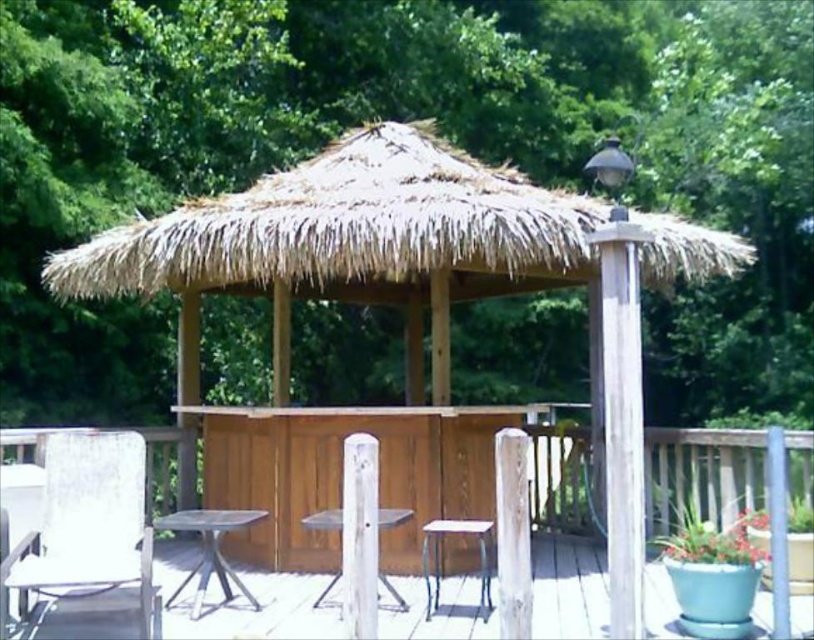
Question: Which point is closer to the camera?

Choices:
 (A) natural thatched roof hut at center
 (B) wooden deck at center

Answer: (A)

Question: Based on their relative distances, which object is farther from the wooden deck at center?

Choices:
 (A) natural thatched roof hut at center
 (B) wooden table at center

Answer: (B)

Question: Can you confirm if green leafy tree at upper center is smaller than white plastic chair at lower left?

Choices:
 (A) no
 (B) yes

Answer: (A)

Question: Is green leafy tree at upper center closer to camera compared to wooden deck at center?

Choices:
 (A) yes
 (B) no

Answer: (B)

Question: Does white plastic chair at lower left appear over wooden table at center?

Choices:
 (A) yes
 (B) no

Answer: (A)

Question: Which object appears farthest from the camera in this image?

Choices:
 (A) wooden deck at center
 (B) metallic silver stool at lower center
 (C) metallic silver table at lower left
 (D) natural thatched roof hut at center

Answer: (A)